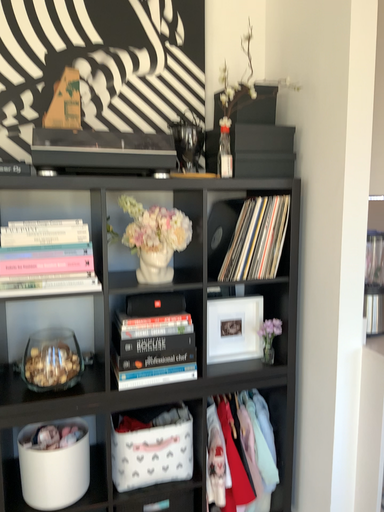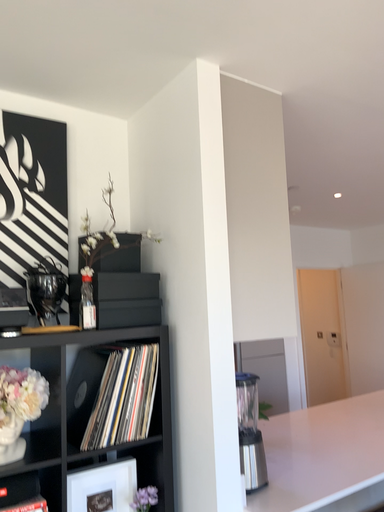
Question: How did the camera likely rotate when shooting the video?

Choices:
 (A) rotated left
 (B) rotated right

Answer: (B)